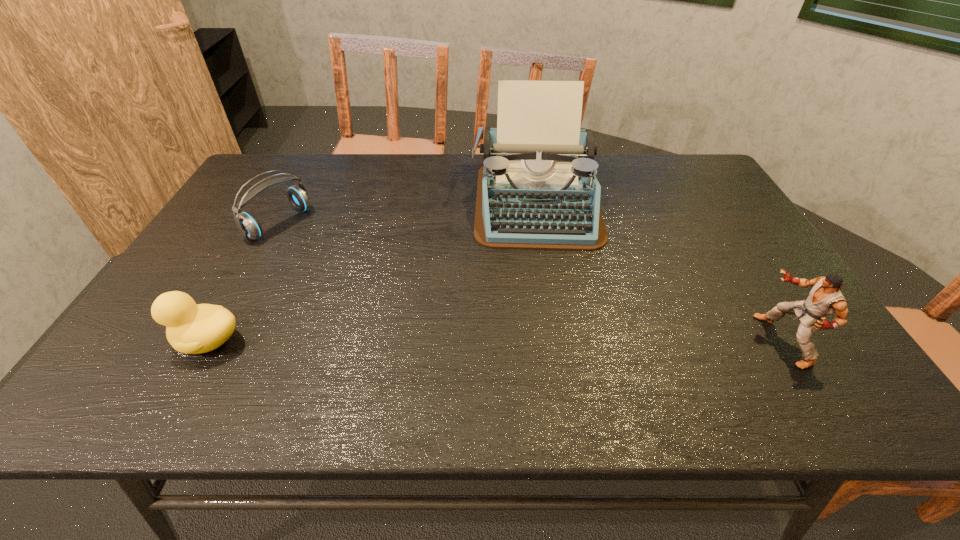
I want to click on free location that satisfies the following two spatial constraints: 1. on the front side of the puncher; 2. on the front-facing side of the third object from left to right, so click(559, 341).